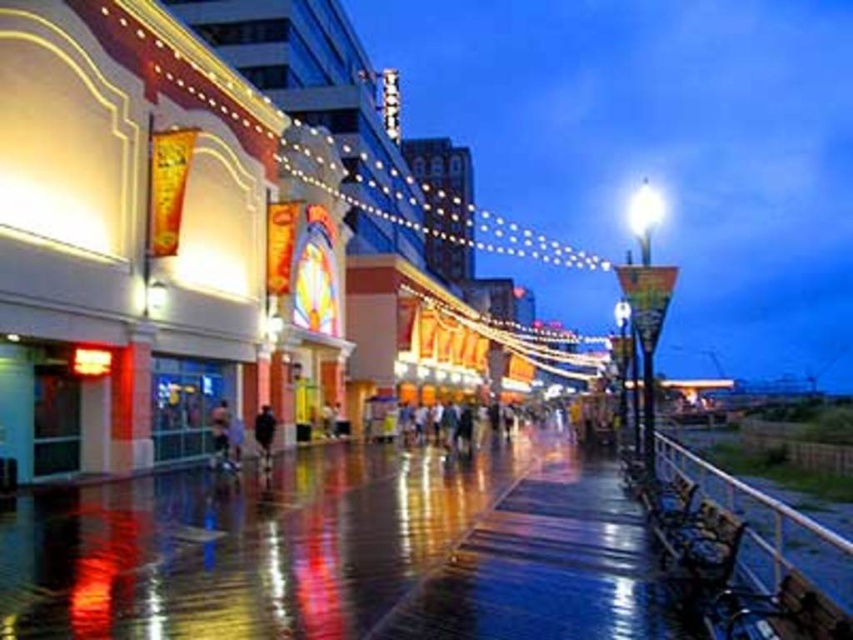
How distant is glossy concrete pavement at center from black matte jacket at center?

glossy concrete pavement at center and black matte jacket at center are 42.34 feet apart from each other.

Is glossy concrete pavement at center to the right of black matte jacket at center from the viewer's perspective?

Yes, glossy concrete pavement at center is to the right of black matte jacket at center.

What do you see at coordinates (341, 552) in the screenshot? I see `glossy concrete pavement at center` at bounding box center [341, 552].

This screenshot has width=853, height=640. I want to click on glossy concrete pavement at center, so click(341, 552).